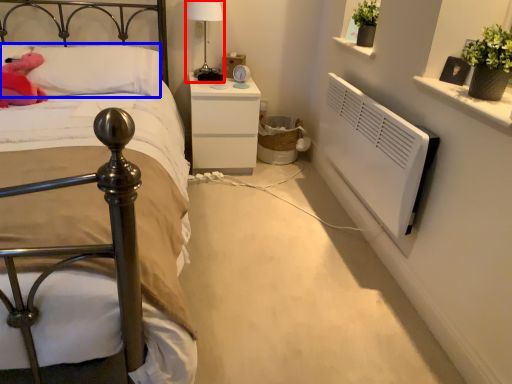
Question: Which point is closer to the camera, bedside lamp (highlighted by a red box) or pillow (highlighted by a blue box)?

Choices:
 (A) bedside lamp
 (B) pillow

Answer: (B)